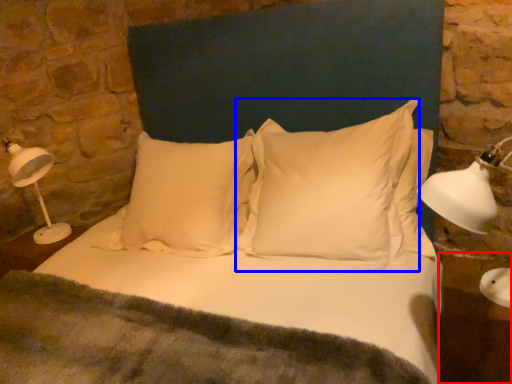
Question: Which point is further to the camera, table (highlighted by a red box) or pillow (highlighted by a blue box)?

Choices:
 (A) table
 (B) pillow

Answer: (B)